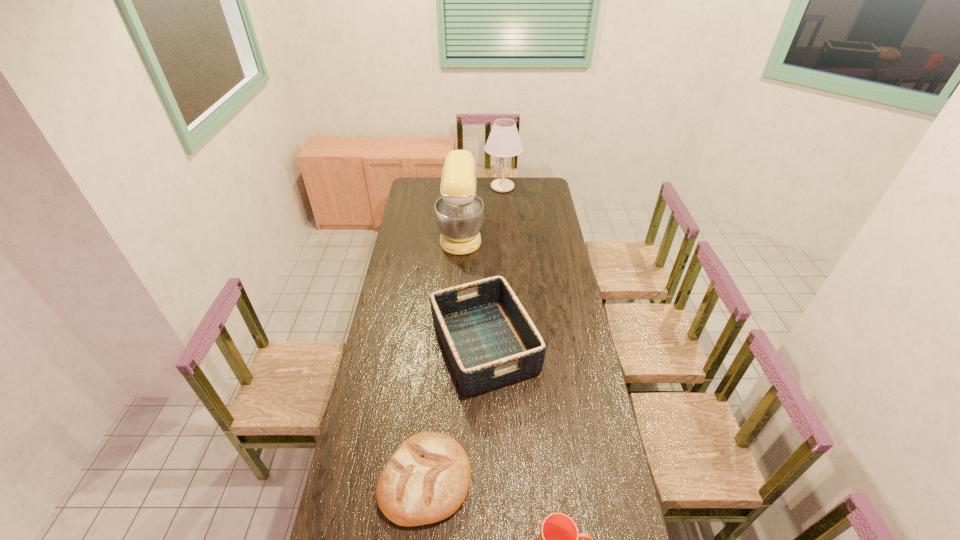
Identify the location of object located at the far edge. (504, 141).

Where is `object situated at the left edge`? Image resolution: width=960 pixels, height=540 pixels. object situated at the left edge is located at coordinates (426, 480).

Locate an element on the screen. This screenshot has width=960, height=540. vacant space at the far edge of the desktop is located at coordinates 491,197.

Find the location of `vacant space at the left edge of the desktop`. vacant space at the left edge of the desktop is located at coordinates (375, 379).

At what (x,y) coordinates should I click in order to perform the action: click on vacant space at the right edge of the desktop. Please return your answer as a coordinate pair (x, y). Image resolution: width=960 pixels, height=540 pixels. Looking at the image, I should click on (585, 446).

Find the location of `free point at the far left corner`. free point at the far left corner is located at coordinates (423, 186).

What are the coordinates of `free space that is in between the shortest object and the second farthest object` in the screenshot? It's located at (443, 356).

This screenshot has height=540, width=960. Find the location of `free space between the mixer and the third farthest object`. free space between the mixer and the third farthest object is located at coordinates (472, 289).

The width and height of the screenshot is (960, 540). What are the coordinates of `vacant space in between the third tallest object and the shortest object` in the screenshot? It's located at (455, 412).

This screenshot has width=960, height=540. I want to click on object that is the fourth nearest to the mixer, so click(558, 539).